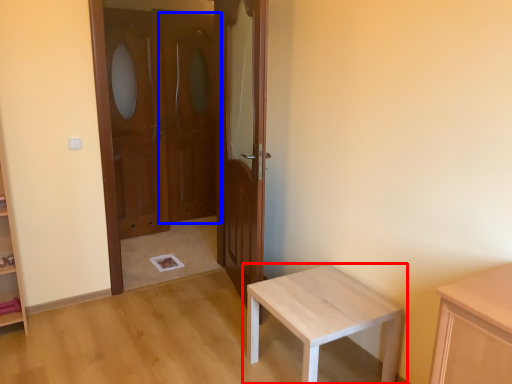
Question: Which point is closer to the camera, table (highlighted by a red box) or screen door (highlighted by a blue box)?

Choices:
 (A) table
 (B) screen door

Answer: (A)